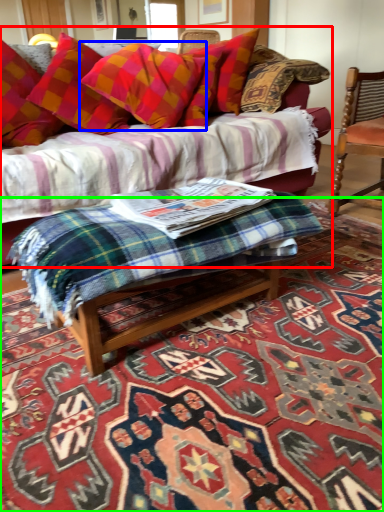
Question: Which is farther away from studio couch (highlighted by a red box)? pillow (highlighted by a blue box) or mat (highlighted by a green box)?

Choices:
 (A) pillow
 (B) mat

Answer: (B)